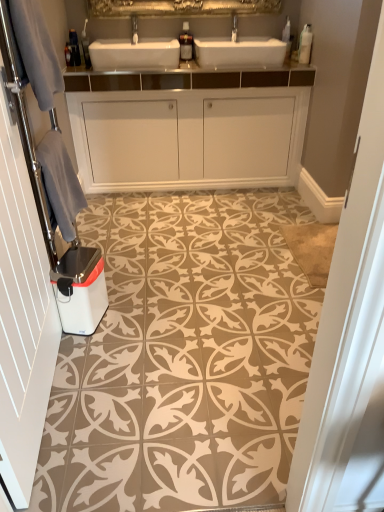
At what (x,y) coordinates should I click in order to perform the action: click on vacant region above brown textured tile at center (from a real-world perspective). Please return your answer as a coordinate pair (x, y). Image resolution: width=384 pixels, height=512 pixels. Looking at the image, I should click on (205, 273).